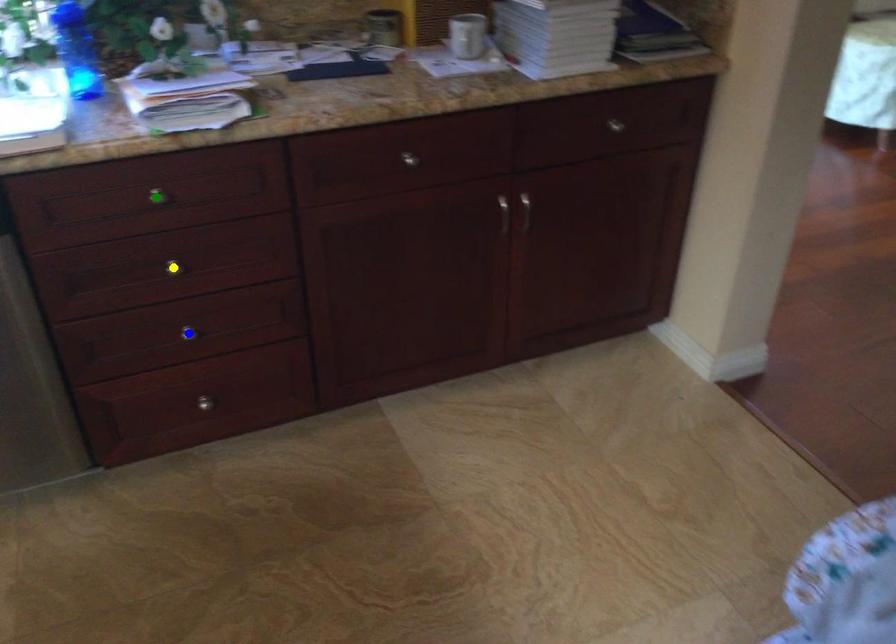
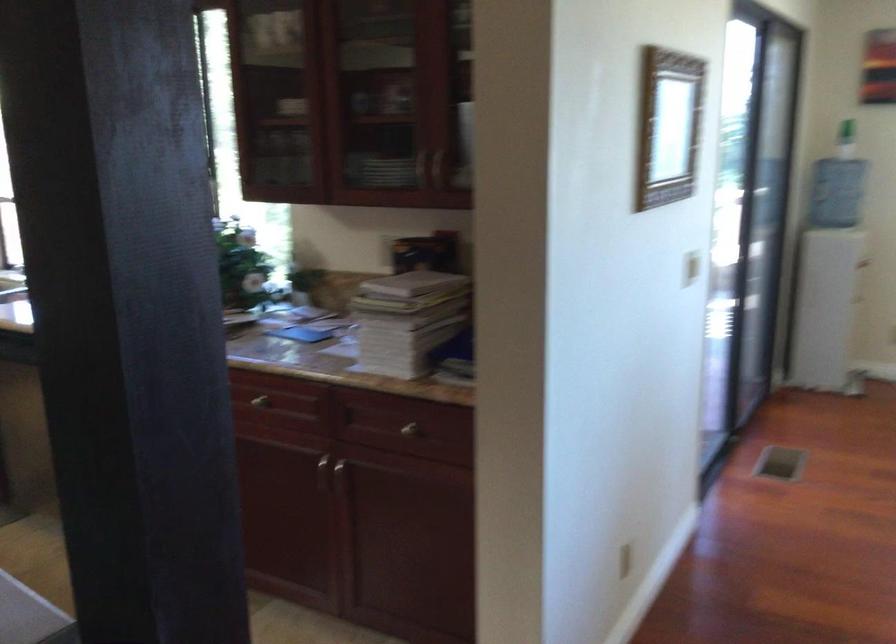
I am providing you with two images of the same scene from different viewpoints. Three points are marked in image1. Which point corresponds to a part or object that is occluded in image2?In image1, three points are marked. Which of them correspond to a part or object that is occluded in image2?Among the three points shown in image1, which one corresponds to a part or object that is no longer visible due to occlusion in image2?

Invisible in image2: green point, blue point, yellow point.